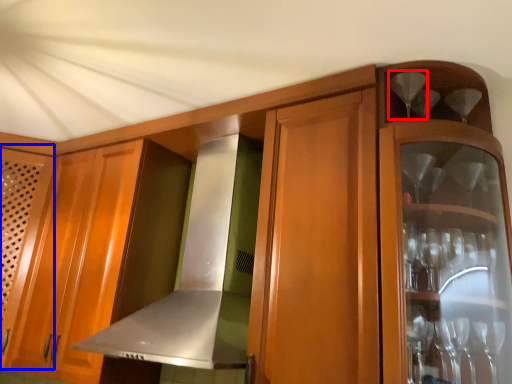
Question: Among these objects, which one is nearest to the camera, wine glass (highlighted by a red box) or door (highlighted by a blue box)?

Choices:
 (A) wine glass
 (B) door

Answer: (A)